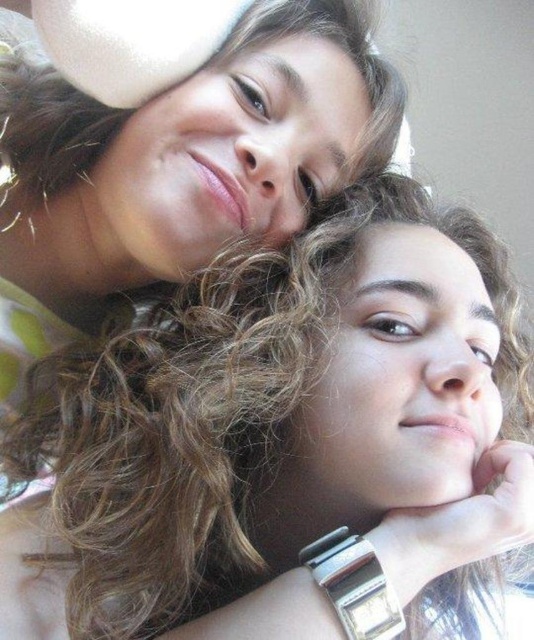
You are a photographer trying to adjust the composition of this selfie. You want to ensure there is enough space between the curly hair at center and the silver metallic watch at lower center for aesthetic balance. Given that the distance between them is 6.80 inches, do you think this spacing is sufficient for a visually appealing portrait?

The distance between the curly hair at center and the silver metallic watch at lower center is 6.80 inches, which provides adequate spacing for a visually appealing portrait as it allows both elements to be distinct without overcrowding the frame.

You are taking a selfie with a friend and want to know which of the two points, point (302, 301) or point (308, 556), is closer to you. Based on the scene description, which point is nearer?

Point (302, 301) is further to the viewer than point (308, 556), so the point closer to you is point (308, 556).

You are taking a selfie with a friend and notice two items in the photo. You see the curly hair at center and the silver metallic watch at lower center. Which item is positioned more to the right side of the photo?

The curly hair at center is positioned more to the right side of the photo compared to the silver metallic watch at lower center.